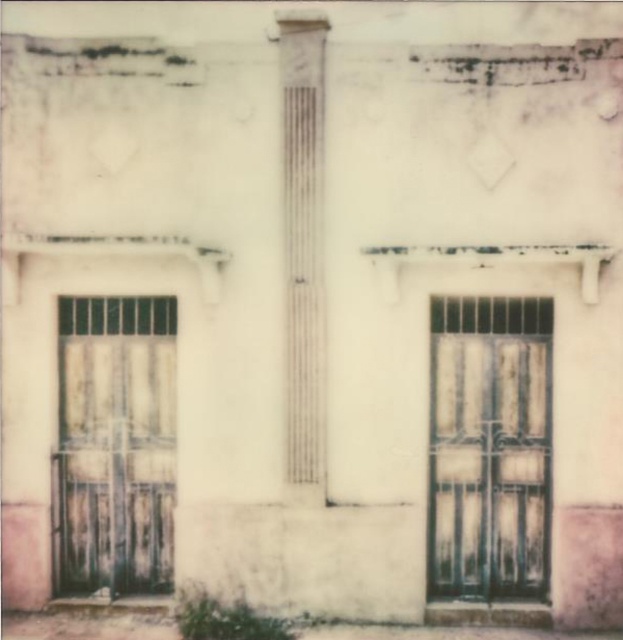
Question: Where is dark green wrought iron door at right located in relation to rusty metal gate at left in the image?

Choices:
 (A) below
 (B) above

Answer: (B)

Question: Is rusty metal gate at left to the right of white textured column at center from the viewer's perspective?

Choices:
 (A) no
 (B) yes

Answer: (A)

Question: Which point is farther from the camera taking this photo?

Choices:
 (A) (292, 356)
 (B) (67, 588)

Answer: (B)

Question: Which point is closer to the camera?

Choices:
 (A) white textured column at center
 (B) rusty metal gate at left

Answer: (A)

Question: Is rusty metal gate at left bigger than white textured column at center?

Choices:
 (A) yes
 (B) no

Answer: (A)

Question: Among these objects, which one is farthest from the camera?

Choices:
 (A) rusty metal gate at left
 (B) white textured column at center

Answer: (A)